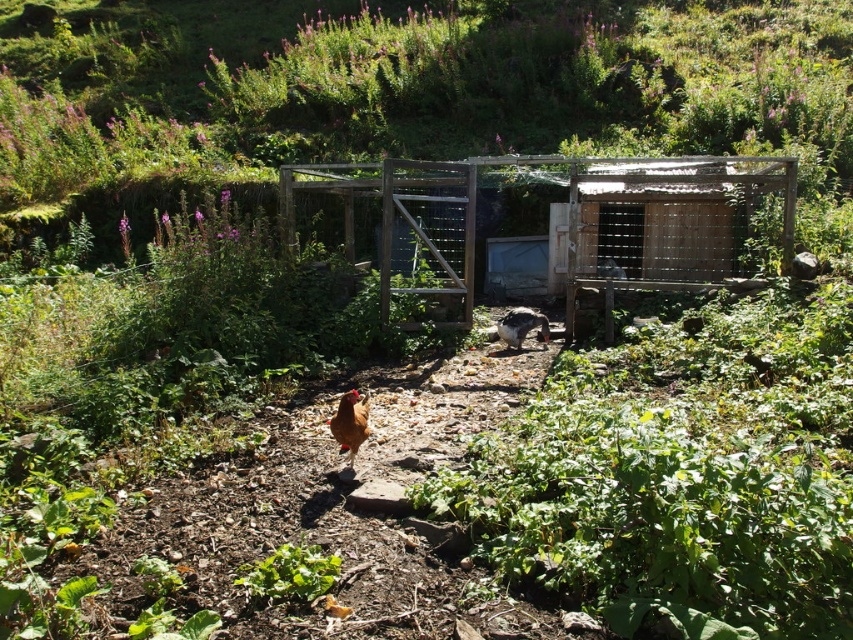
Question: Is wooden chicken coop at center to the right of white glossy chicken at center from the viewer's perspective?

Choices:
 (A) no
 (B) yes

Answer: (B)

Question: Which point appears closest to the camera in this image?

Choices:
 (A) (631, 212)
 (B) (364, 401)
 (C) (520, 337)

Answer: (B)

Question: Considering the real-world distances, which object is farthest from the white glossy chicken at center?

Choices:
 (A) wooden chicken coop at center
 (B) brown matte chicken at center

Answer: (B)

Question: Which object appears farthest from the camera in this image?

Choices:
 (A) wooden chicken coop at center
 (B) brown matte chicken at center

Answer: (A)

Question: Can you confirm if wooden chicken coop at center is smaller than brown matte chicken at center?

Choices:
 (A) no
 (B) yes

Answer: (A)

Question: Can you confirm if brown matte chicken at center is wider than white glossy chicken at center?

Choices:
 (A) yes
 (B) no

Answer: (B)